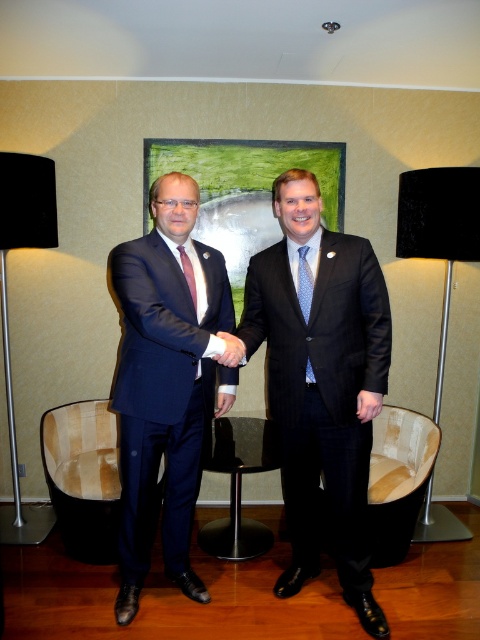
Question: Is shiny black suit at center in front of matte red tie at center?

Choices:
 (A) no
 (B) yes

Answer: (B)

Question: Is matte black suit at center to the left of blue dotted tie at center from the viewer's perspective?

Choices:
 (A) yes
 (B) no

Answer: (A)

Question: Is blue dotted tie at center further to camera compared to matte black hand at center?

Choices:
 (A) no
 (B) yes

Answer: (B)

Question: Which point is farther from the camera taking this photo?

Choices:
 (A) (304, 248)
 (B) (191, 291)
 (C) (424, 202)
 (D) (232, 337)

Answer: (C)

Question: Which object appears closest to the camera in this image?

Choices:
 (A) black fabric lamp at left
 (B) blue dotted tie at center
 (C) matte red tie at center
 (D) matte black suit at center

Answer: (D)

Question: Based on their relative distances, which object is farther from the matte black hand at center?

Choices:
 (A) matte red tie at center
 (B) matte black suit at center

Answer: (B)